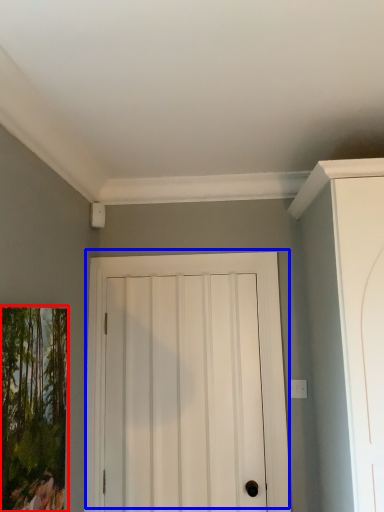
Question: Which object is further to the camera taking this photo, picture frame (highlighted by a red box) or door (highlighted by a blue box)?

Choices:
 (A) picture frame
 (B) door

Answer: (B)